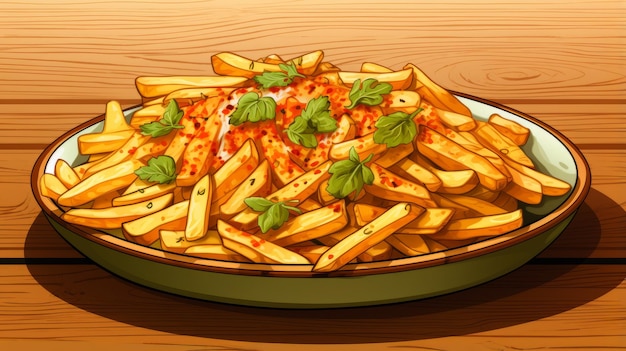
At what (x,y) coordinates should I click in order to perform the action: click on wooden boards. Please return your answer as a coordinate pair (x, y). Looking at the image, I should click on (601, 321), (615, 202), (590, 114), (566, 38).